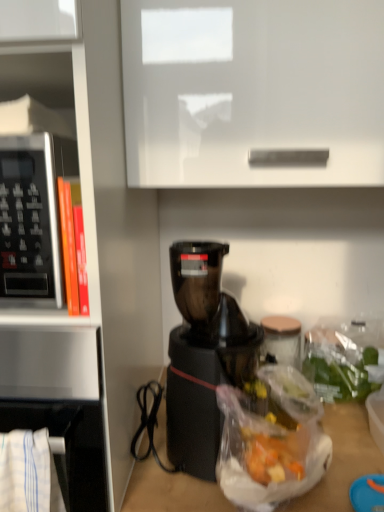
Question: Is satin silver microwave at left situated inside black plastic coffee maker at center or outside?

Choices:
 (A) outside
 (B) inside

Answer: (A)

Question: From the image's perspective, is satin silver microwave at left located above or below black plastic coffee maker at center?

Choices:
 (A) below
 (B) above

Answer: (B)

Question: Which object is the farthest from the black plastic microwave at left?

Choices:
 (A) black plastic coffee maker at center
 (B) white glossy cabinet at upper center
 (C) satin silver microwave at left
 (D) translucent plastic bag at lower right

Answer: (D)

Question: Which object is the closest to the black plastic coffee maker at center?

Choices:
 (A) black plastic microwave at left
 (B) white glossy cabinet at upper center
 (C) satin silver microwave at left
 (D) translucent plastic bag at lower right

Answer: (C)